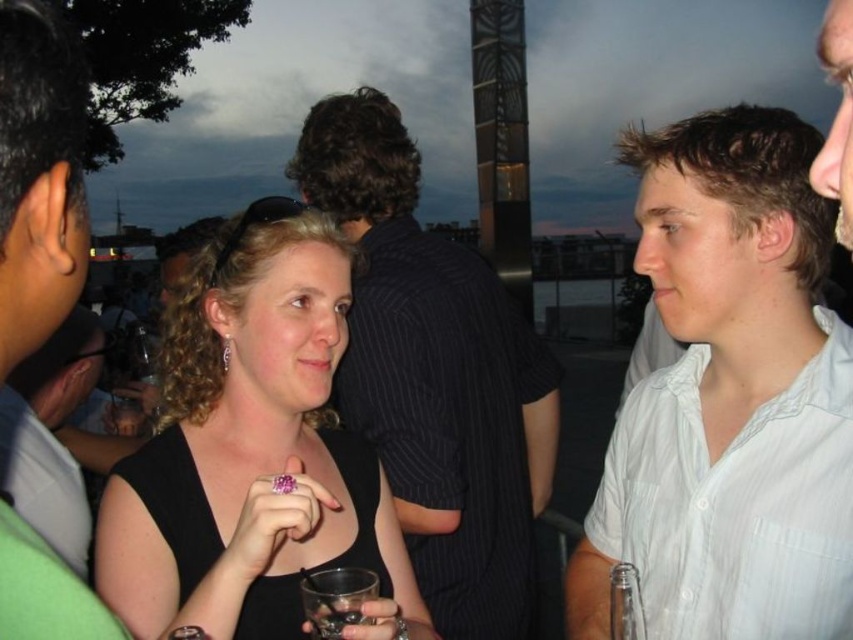
Locate an element on the screen. The image size is (853, 640). white striped shirt at right is located at coordinates (735, 502).

Which is behind, point (817, 592) or point (350, 609)?

Positioned behind is point (350, 609).

Locate an element on the screen. white striped shirt at right is located at coordinates (735, 502).

Which is more to the left, black striped shirt at center or white striped shirt at right?

black striped shirt at center

Does black striped shirt at center appear on the right side of white striped shirt at right?

In fact, black striped shirt at center is to the left of white striped shirt at right.

Between point (523, 531) and point (635, 561), which one is positioned behind?

Point (523, 531)

Locate an element on the screen. black striped shirt at center is located at coordinates (434, 376).

This screenshot has width=853, height=640. Describe the element at coordinates (252, 451) in the screenshot. I see `black matte dress at center` at that location.

Between black matte dress at center and white striped shirt at right, which one appears on the left side from the viewer's perspective?

black matte dress at center is more to the left.

The image size is (853, 640). Describe the element at coordinates (252, 451) in the screenshot. I see `black matte dress at center` at that location.

What are the coordinates of `black matte dress at center` in the screenshot? It's located at (252, 451).